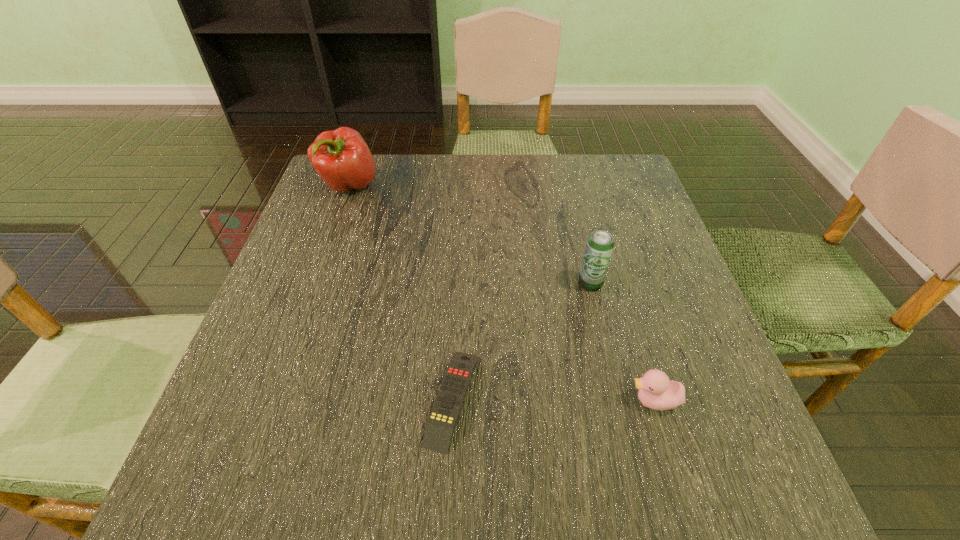
The height and width of the screenshot is (540, 960). Identify the location of the leftmost object. (341, 157).

This screenshot has height=540, width=960. Identify the location of the tallest object. (341, 157).

At what (x,y) coordinates should I click in order to perform the action: click on the second farthest object. Please return your answer as a coordinate pair (x, y). Image resolution: width=960 pixels, height=540 pixels. Looking at the image, I should click on (600, 244).

I want to click on the second tallest object, so click(x=600, y=244).

Locate an element on the screen. Image resolution: width=960 pixels, height=540 pixels. the second shortest object is located at coordinates (656, 391).

In order to click on remote control in this screenshot , I will do `click(444, 415)`.

Identify the location of the shortest object. (444, 415).

You are a GUI agent. You are given a task and a screenshot of the screen. Output one action in this format:
    pyautogui.click(x=<x>, y=<y>)
    Task: Click on the free point located on the right of the pepper
    The height and width of the screenshot is (540, 960).
    Given the screenshot: What is the action you would take?
    pyautogui.click(x=472, y=186)

Find the location of a particular element. This screenshot has width=960, height=540. vacant area situated 0.280m on the front of the beer can is located at coordinates (625, 427).

At what (x,y) coordinates should I click in order to perform the action: click on vacant space situated on the front-facing side of the duckling. Please return your answer as a coordinate pair (x, y). Image resolution: width=960 pixels, height=540 pixels. Looking at the image, I should click on (585, 401).